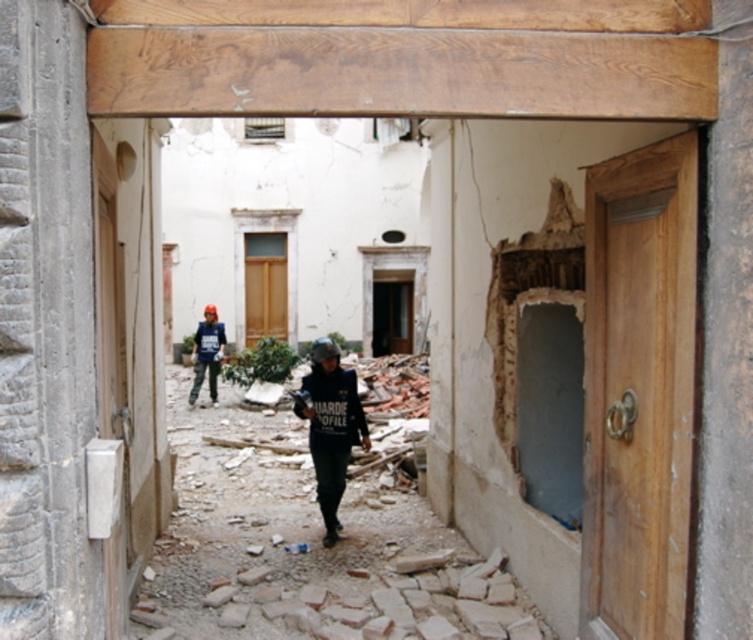
Question: Does dark blue uniform at center appear on the left side of camouflage pants at center?

Choices:
 (A) no
 (B) yes

Answer: (A)

Question: Can you confirm if dark blue uniform at center is bigger than camouflage pants at center?

Choices:
 (A) no
 (B) yes

Answer: (A)

Question: Is dark blue uniform at center bigger than camouflage pants at center?

Choices:
 (A) no
 (B) yes

Answer: (A)

Question: Which object is farther from the camera taking this photo?

Choices:
 (A) camouflage pants at center
 (B) dark blue uniform at center

Answer: (A)

Question: Among these points, which one is nearest to the camera?

Choices:
 (A) (212, 371)
 (B) (319, 426)

Answer: (B)